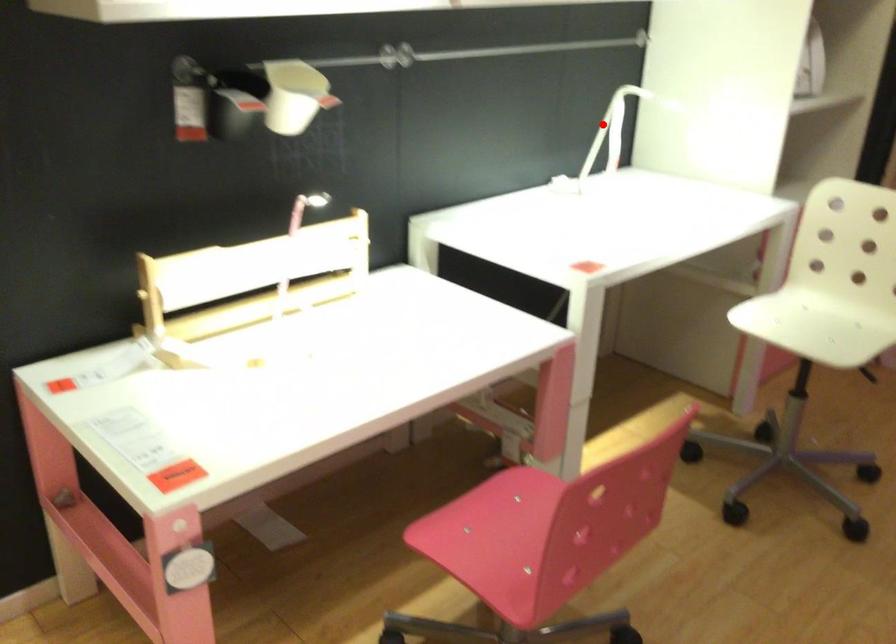
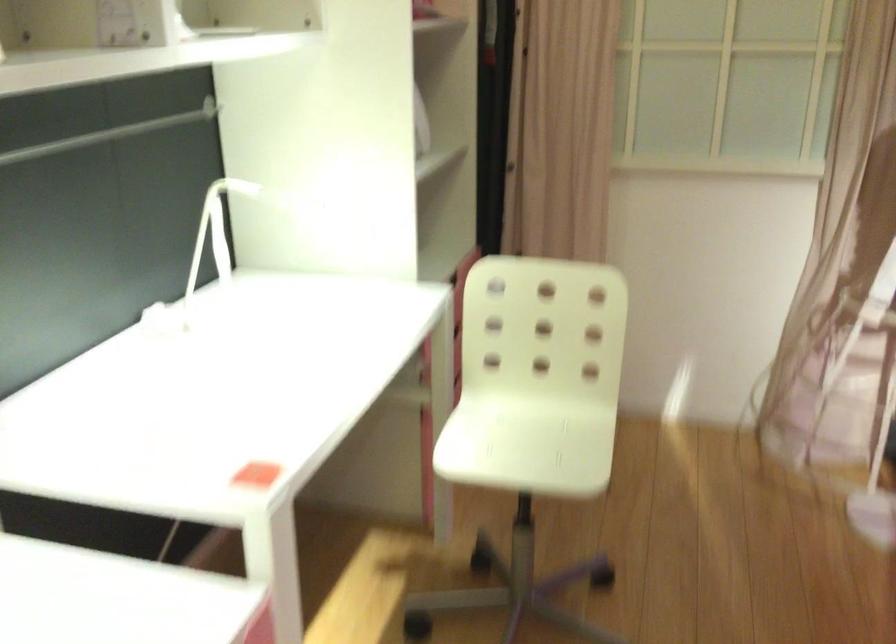
Question: I am providing you with two images of the same scene from different viewpoints. In image1, a red point is highlighted. Considering the same 3D point in image2, which of the following is correct?

Choices:
 (A) It is closer
 (B) It is farther

Answer: (A)